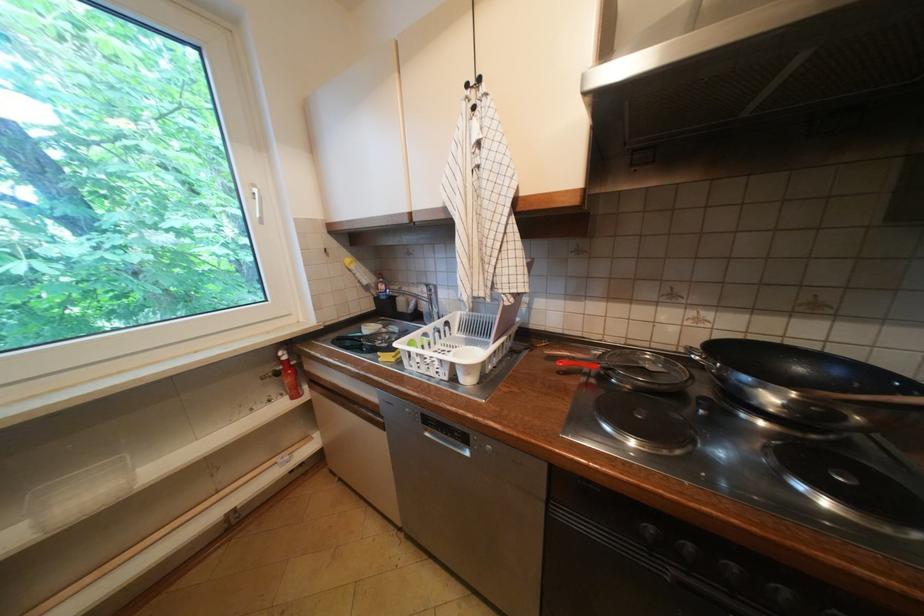
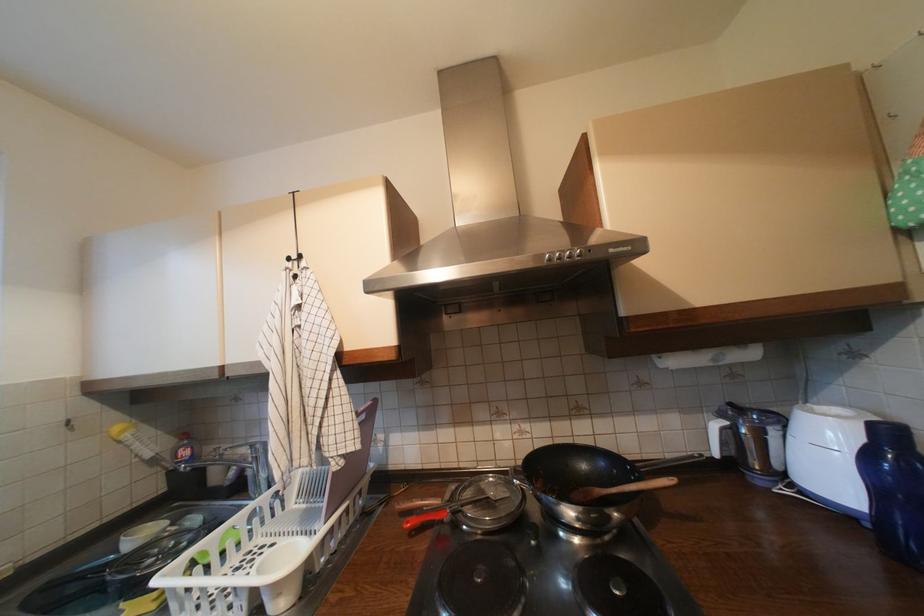
The point at (387, 280) is marked in the first image. Where is the corresponding point in the second image?

(189, 440)